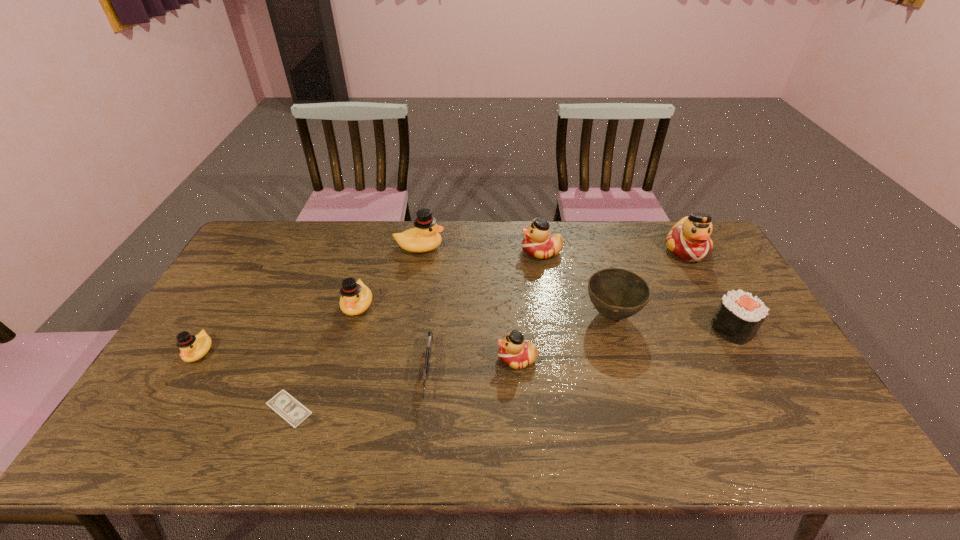
At what (x,y) coordinates should I click in order to perform the action: click on vacant space located on the face of the second biggest red duck. Please return your answer as a coordinate pair (x, y). Image resolution: width=960 pixels, height=540 pixels. Looking at the image, I should click on (426, 252).

Locate an element on the screen. vacant area located on the face of the second biggest red duck is located at coordinates (490, 252).

Where is `vacant space located on the front-facing side of the fifth duck from right to left`? vacant space located on the front-facing side of the fifth duck from right to left is located at coordinates (341, 364).

I want to click on vacant space located on the right of the brown bowl, so click(x=713, y=315).

Locate an element on the screen. free region located on the back of the sushi is located at coordinates (713, 295).

Find the location of a particular element. vacant space situated on the face of the nearest red duck is located at coordinates (380, 359).

This screenshot has height=540, width=960. Find the location of `vacant space situated on the face of the nearest red duck`. vacant space situated on the face of the nearest red duck is located at coordinates coord(465,359).

Identify the location of free space located on the face of the nearest red duck. The image size is (960, 540). (409, 359).

The width and height of the screenshot is (960, 540). I want to click on vacant region located 0.230m on the front-facing side of the leftmost yellow duck, so click(141, 450).

At what (x,y) coordinates should I click in order to perform the action: click on vacant space located 0.240m on the back of the money. Please return your answer as a coordinate pair (x, y). Looking at the image, I should click on (321, 320).